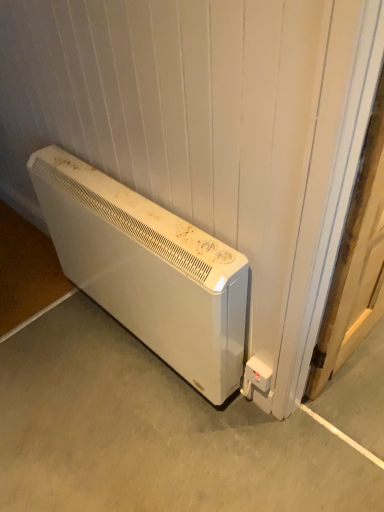
This screenshot has width=384, height=512. I want to click on vacant area that is situated to the right of white plastic electric outlet at lower right, so click(307, 419).